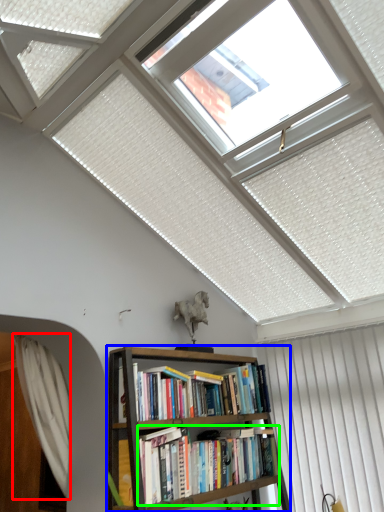
Question: Which is nearer to the curtain (highlighted by a red box)? bookcase (highlighted by a blue box) or book (highlighted by a green box).

Choices:
 (A) bookcase
 (B) book

Answer: (A)